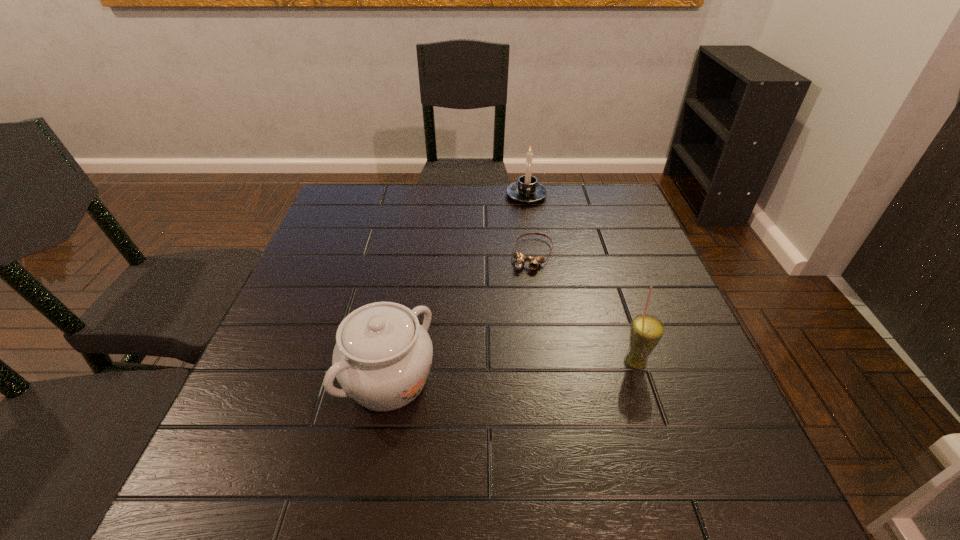
This screenshot has height=540, width=960. In order to click on vacant area between the chinaware and the rightmost object in this screenshot , I will do `click(512, 371)`.

Where is `vacant area that lies between the straw for drinking and the second farthest object`? vacant area that lies between the straw for drinking and the second farthest object is located at coordinates (584, 308).

The height and width of the screenshot is (540, 960). Find the location of `the second closest object relative to the rightmost object`. the second closest object relative to the rightmost object is located at coordinates (382, 357).

Locate an element on the screen. This screenshot has height=540, width=960. object that stands as the closest to the straw for drinking is located at coordinates (520, 261).

I want to click on vacant region that satisfies the following two spatial constraints: 1. on the front side of the shortest object; 2. on the left side of the rightmost object, so click(549, 362).

At what (x,y) coordinates should I click in order to perform the action: click on vacant point that satisfies the following two spatial constraints: 1. on the front side of the farthest object; 2. on the right side of the straw for drinking. Please return your answer as a coordinate pair (x, y). This screenshot has width=960, height=540. Looking at the image, I should click on (552, 362).

Image resolution: width=960 pixels, height=540 pixels. I want to click on free location that satisfies the following two spatial constraints: 1. on the back side of the leftmost object; 2. on the right side of the candle holder, so click(423, 195).